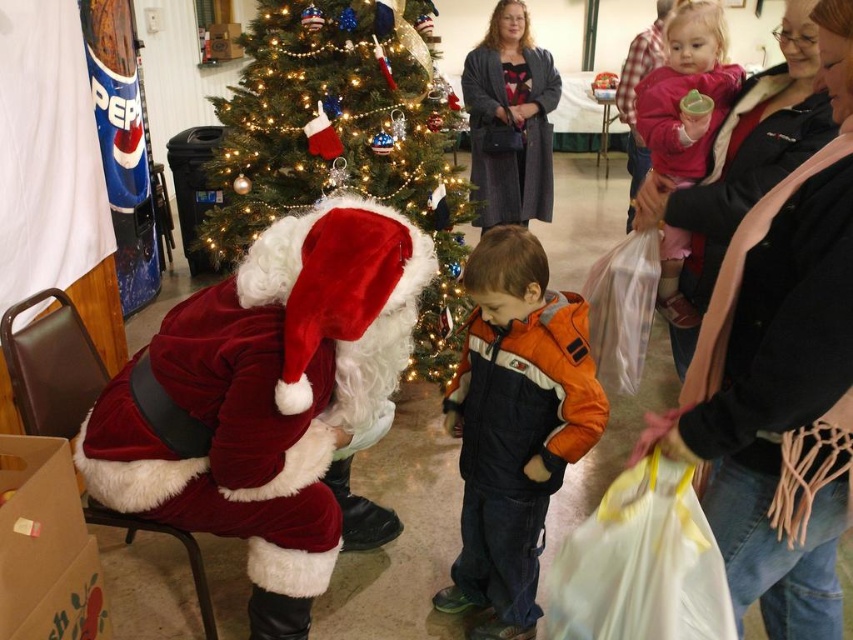
Can you confirm if shiny green christmas tree at center is taller than brown paper box at lower left?

Yes.

Who is higher up, shiny green christmas tree at center or brown paper box at lower left?

shiny green christmas tree at center

Where is `shiny green christmas tree at center`? shiny green christmas tree at center is located at coordinates (343, 140).

This screenshot has height=640, width=853. I want to click on shiny green christmas tree at center, so click(x=343, y=140).

Where is `velvet santa at left`? Image resolution: width=853 pixels, height=640 pixels. velvet santa at left is located at coordinates (265, 397).

Does velvet santa at left appear under brown paper box at lower left?

No.

Who is more distant from viewer, (90, 445) or (55, 609)?

The point (90, 445) is behind.

Find the location of a particular element. velvet santa at left is located at coordinates (265, 397).

The width and height of the screenshot is (853, 640). Describe the element at coordinates (514, 426) in the screenshot. I see `orange fleece jacket at center` at that location.

Looking at this image, is orange fleece jacket at center to the right of brown paper box at lower left from the viewer's perspective?

Yes, orange fleece jacket at center is to the right of brown paper box at lower left.

Is point (525, 262) positioned behind point (35, 449)?

That is True.

Locate an element on the screen. The width and height of the screenshot is (853, 640). orange fleece jacket at center is located at coordinates (514, 426).